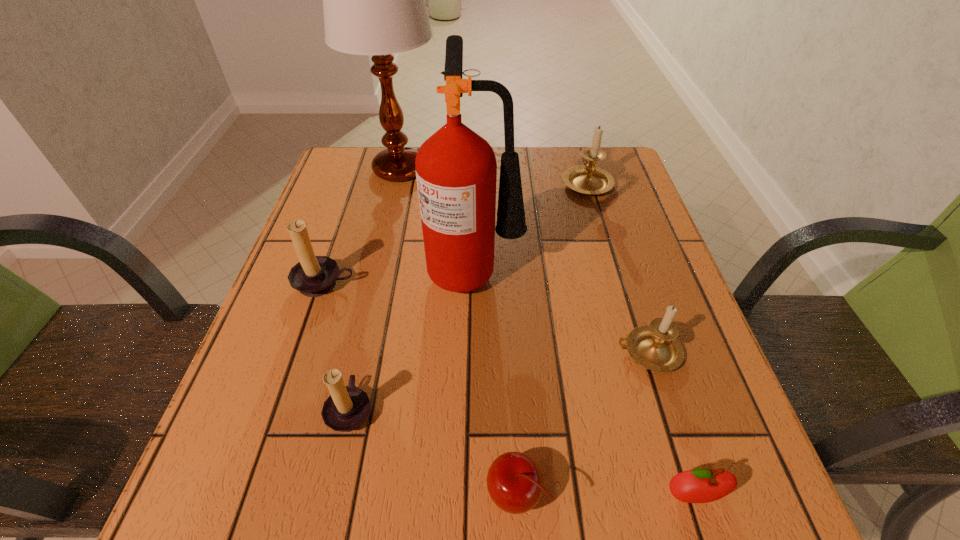
What are the coordinates of `apple` in the screenshot? It's located at (701, 485).

Locate an element on the screen. The height and width of the screenshot is (540, 960). cherry is located at coordinates (515, 483).

The height and width of the screenshot is (540, 960). In order to click on free spot located 0.330m on the front of the white table lamp in this screenshot , I will do `click(372, 289)`.

Identify the location of free space located at the nozzle of the fire extinguisher. (606, 268).

Where is `vacant space located on the wick of the third nearest candle holder`? The width and height of the screenshot is (960, 540). vacant space located on the wick of the third nearest candle holder is located at coordinates (301, 351).

At what (x,y) coordinates should I click in order to perform the action: click on free space located 0.390m on the wick of the right brown candle holder. Please return your answer as a coordinate pair (x, y). The image size is (960, 540). Looking at the image, I should click on (611, 409).

Identify the location of free location located 0.150m with a handle on the side of the third farthest candle holder. (532, 352).

Where is `vacant space located with a handle on the side of the third farthest candle holder`? vacant space located with a handle on the side of the third farthest candle holder is located at coordinates (395, 352).

Identify the location of free space located with a handle on the side of the third farthest candle holder. The image size is (960, 540). (571, 352).

Find the location of `free location located 0.240m on the back of the apple`. free location located 0.240m on the back of the apple is located at coordinates (645, 347).